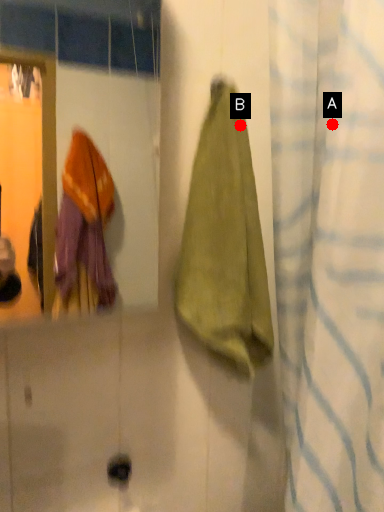
Question: Two points are circled on the image, labeled by A and B beside each circle. Which point is farther to the camera?

Choices:
 (A) A is further
 (B) B is further

Answer: (B)